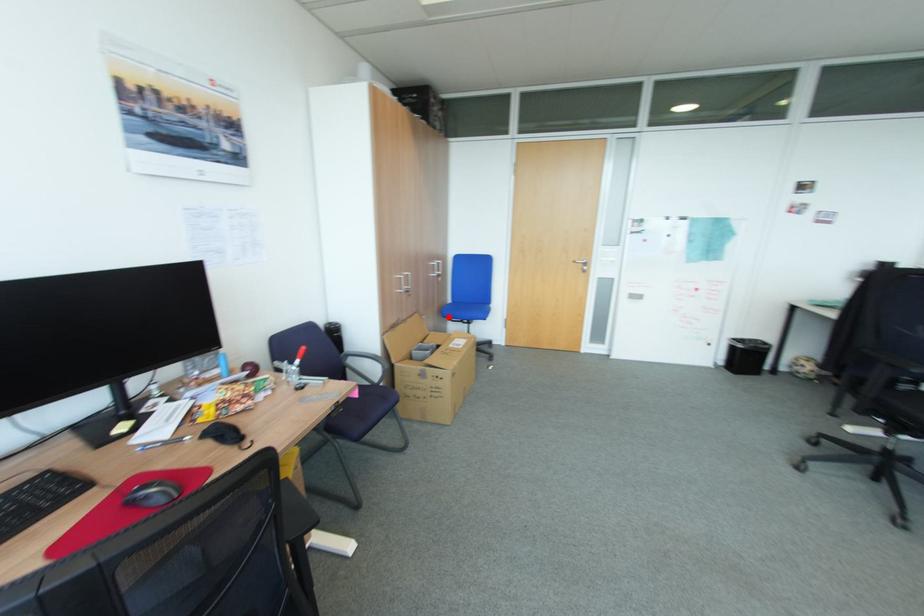
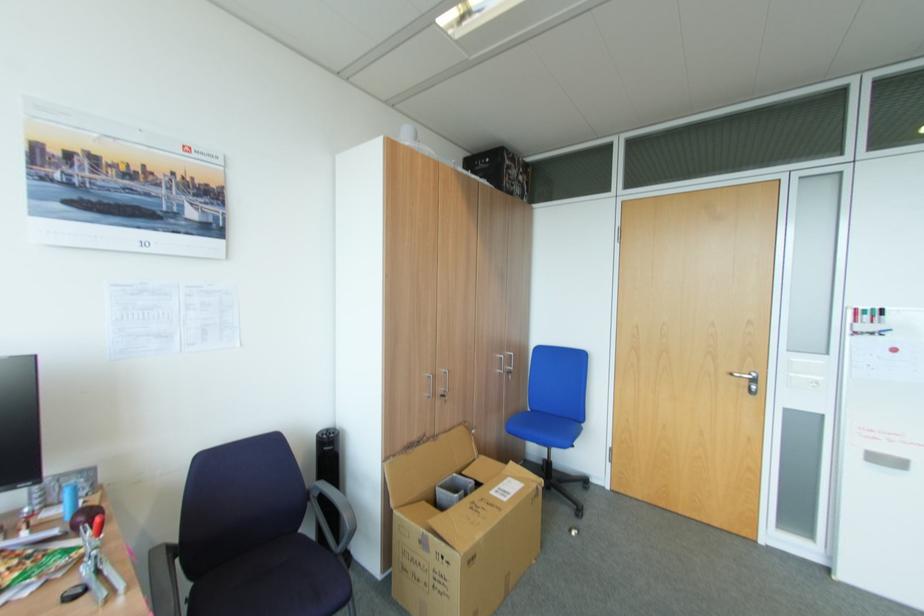
The point at the highlighted location is marked in the first image. Where is the corresponding point in the second image?

(515, 431)